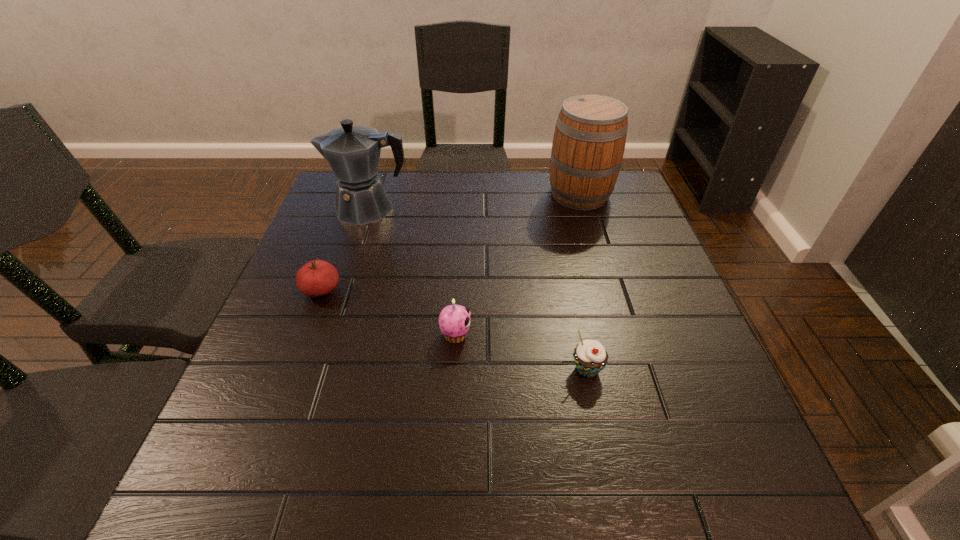
In the image, there is a desktop. Identify the location of vacant space at the left edge. (303, 254).

Locate an element on the screen. The height and width of the screenshot is (540, 960). free space at the right edge of the desktop is located at coordinates (687, 340).

What are the coordinates of `vacant area that lies between the coffeepot and the cider` in the screenshot? It's located at (474, 201).

Where is `empty space that is in between the cider and the right cupcake`? empty space that is in between the cider and the right cupcake is located at coordinates (584, 282).

Locate an element on the screen. The image size is (960, 540). free space between the tomato and the coffeepot is located at coordinates (346, 249).

Identify the location of empty location between the third nearest object and the cider. This screenshot has height=540, width=960. (450, 242).

Find the location of a particular element. The width and height of the screenshot is (960, 540). vacant space that is in between the fourth farthest object and the coffeepot is located at coordinates (412, 272).

Locate an element on the screen. The width and height of the screenshot is (960, 540). empty location between the cider and the nearest object is located at coordinates (584, 282).

You are a GUI agent. You are given a task and a screenshot of the screen. Output one action in this format:
    pyautogui.click(x=<x>, y=<y>)
    Task: Click on the free space between the cider and the coffeepot
    
    Given the screenshot: What is the action you would take?
    pyautogui.click(x=474, y=201)

You are a GUI agent. You are given a task and a screenshot of the screen. Output one action in this format:
    pyautogui.click(x=<x>, y=<y>)
    Task: Click on the free area in between the coffeepot and the right cupcake
    
    Given the screenshot: What is the action you would take?
    478,289